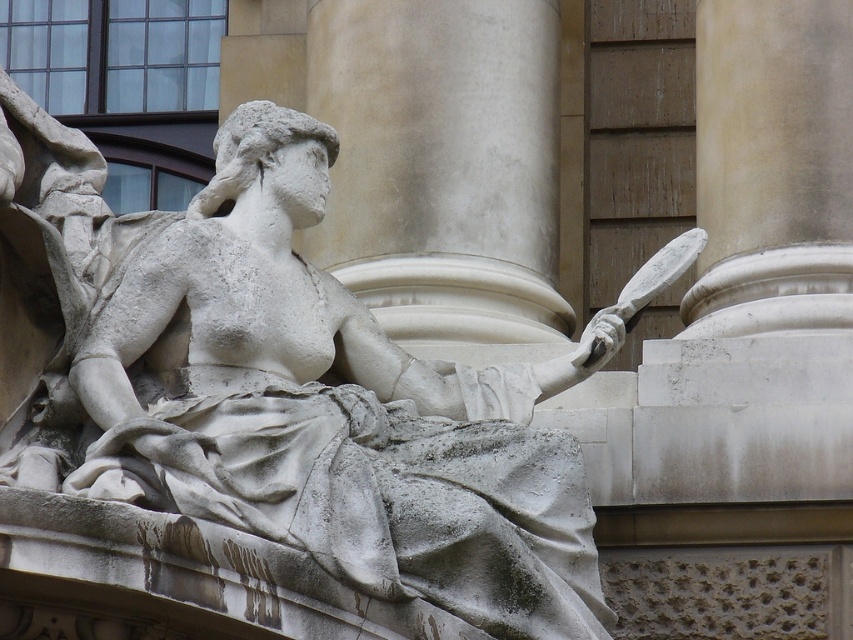
Question: Is the position of white stone statue at center less distant than that of white marble column at center?

Choices:
 (A) yes
 (B) no

Answer: (A)

Question: Which point is closer to the camera?

Choices:
 (A) white marble column at center
 (B) white stone statue at center

Answer: (B)

Question: Which object appears farthest from the camera in this image?

Choices:
 (A) white stone statue at center
 (B) white marble column at center

Answer: (B)

Question: Does white stone statue at center appear on the right side of white marble column at center?

Choices:
 (A) yes
 (B) no

Answer: (B)

Question: Which point is closer to the camera?

Choices:
 (A) white marble column at center
 (B) white stone statue at center

Answer: (B)

Question: Where is white stone statue at center located in relation to white marble column at center in the image?

Choices:
 (A) right
 (B) left

Answer: (B)